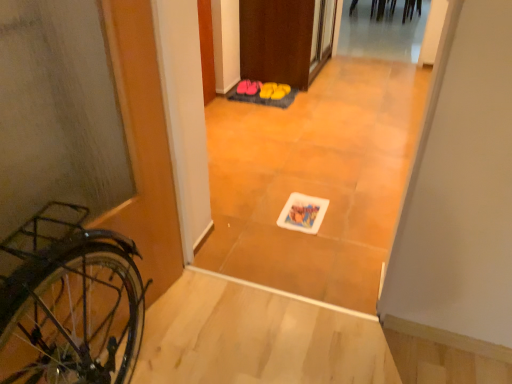
What do you see at coordinates (253, 87) in the screenshot?
I see `pink fabric slippers at center, the second footwear from the left` at bounding box center [253, 87].

The width and height of the screenshot is (512, 384). What do you see at coordinates (131, 144) in the screenshot?
I see `matte black bicycle at left` at bounding box center [131, 144].

You are a GUI agent. You are given a task and a screenshot of the screen. Output one action in this format:
    pyautogui.click(x=<x>, y=<y>)
    Task: Click on the pink fabric slippers at center, arranged as the 3th footwear when viewed from the left
    This screenshot has width=512, height=384.
    Given the screenshot: What is the action you would take?
    pyautogui.click(x=263, y=89)

Is pink fabric slippers at center, which is the 4th footwear in right-to-left order, far from yellow fabric shoe at center, acting as the fourth footwear starting from the left?

pink fabric slippers at center, which is the 4th footwear in right-to-left order, is near yellow fabric shoe at center, acting as the fourth footwear starting from the left, not far away.

Can you confirm if pink fabric slippers at center, the second footwear from the left, is positioned to the left of yellow fabric shoe at center, acting as the fourth footwear starting from the left?

Indeed, pink fabric slippers at center, the second footwear from the left, is positioned on the left side of yellow fabric shoe at center, acting as the fourth footwear starting from the left.

Considering the sizes of objects pink fabric slippers at center, which is the 4th footwear in right-to-left order, and yellow fabric shoe at center, acting as the fourth footwear starting from the left, in the image provided, who is smaller, pink fabric slippers at center, which is the 4th footwear in right-to-left order, or yellow fabric shoe at center, acting as the fourth footwear starting from the left,?

pink fabric slippers at center, which is the 4th footwear in right-to-left order, is smaller.

Considering the relative positions of yellow fabric shoe at center, acting as the fourth footwear starting from the left, and matte black bicycle at left in the image provided, is yellow fabric shoe at center, acting as the fourth footwear starting from the left, behind matte black bicycle at left?

Yes, it is behind matte black bicycle at left.

From a real-world perspective, is yellow fabric shoe at center, marked as the second footwear in a right-to-left arrangement, physically below matte black bicycle at left?

Yes, from a real-world perspective, yellow fabric shoe at center, marked as the second footwear in a right-to-left arrangement, is beneath matte black bicycle at left.

Between yellow fabric shoe at center, acting as the fourth footwear starting from the left, and matte black bicycle at left, which one has larger size?

Bigger between the two is matte black bicycle at left.

Is there a large distance between pink fabric slippers at center, the second footwear from the left, and yellow rubber boots at center, arranged as the 5th footwear when viewed from the left?

No.

Considering the positions of objects pink fabric slippers at center, which is the 4th footwear in right-to-left order, and yellow rubber boots at center, marked as the 1th footwear in a right-to-left arrangement, in the image provided, who is more to the left, pink fabric slippers at center, which is the 4th footwear in right-to-left order, or yellow rubber boots at center, marked as the 1th footwear in a right-to-left arrangement,?

pink fabric slippers at center, which is the 4th footwear in right-to-left order.

How distant is pink fabric slippers at center, which is the 4th footwear in right-to-left order, from yellow rubber boots at center, marked as the 1th footwear in a right-to-left arrangement?

The distance of pink fabric slippers at center, which is the 4th footwear in right-to-left order, from yellow rubber boots at center, marked as the 1th footwear in a right-to-left arrangement, is 7.27 inches.

Which of these two, pink fabric slippers at center, which is the 4th footwear in right-to-left order, or yellow rubber boots at center, marked as the 1th footwear in a right-to-left arrangement, is bigger?

yellow rubber boots at center, marked as the 1th footwear in a right-to-left arrangement.

Does yellow fabric shoe at center, acting as the fourth footwear starting from the left, lie in front of pink fabric slippers at center, arranged as the 3th footwear when viewed from the left?

That is False.

Is yellow fabric shoe at center, acting as the fourth footwear starting from the left, taller or shorter than pink fabric slippers at center, the third footwear viewed from the right?

yellow fabric shoe at center, acting as the fourth footwear starting from the left, is shorter than pink fabric slippers at center, the third footwear viewed from the right.

From the image's perspective, which one is positioned higher, yellow fabric shoe at center, acting as the fourth footwear starting from the left, or pink fabric slippers at center, arranged as the 3th footwear when viewed from the left?

yellow fabric shoe at center, acting as the fourth footwear starting from the left, is shown above in the image.

Does point (274, 91) appear closer or farther from the camera than point (252, 95)?

Point (274, 91) is closer to the camera than point (252, 95).

From a real-world perspective, is pink fabric slippers at center, the third footwear viewed from the right, physically above matte black bicycle at left?

Actually, pink fabric slippers at center, the third footwear viewed from the right, is physically below matte black bicycle at left in the real world.

In the scene shown: Is pink fabric slippers at center, arranged as the 3th footwear when viewed from the left, positioned in front of matte black bicycle at left?

No.

Based on the photo, is pink fabric slippers at center, the third footwear viewed from the right, far away from matte black bicycle at left?

Yes.

Considering the sizes of matte black bicycle at left and pink fabric slippers at center, the third footwear viewed from the right, in the image, is matte black bicycle at left taller or shorter than pink fabric slippers at center, the third footwear viewed from the right,?

In the image, matte black bicycle at left appears to be taller than pink fabric slippers at center, the third footwear viewed from the right.

From the image's perspective, which is above, matte black bicycle at left or pink fabric slippers at center, arranged as the 3th footwear when viewed from the left?

pink fabric slippers at center, arranged as the 3th footwear when viewed from the left, appears higher in the image.

From the picture: Is matte black bicycle at left facing away from pink fabric slippers at center, arranged as the 3th footwear when viewed from the left?

matte black bicycle at left is not turned away from pink fabric slippers at center, arranged as the 3th footwear when viewed from the left.

Where is `door that is on the left side of pink fabric shoe at center, acting as the first footwear starting from the left`? Image resolution: width=512 pixels, height=384 pixels. door that is on the left side of pink fabric shoe at center, acting as the first footwear starting from the left is located at coordinates pyautogui.click(x=131, y=144).

Does matte black bicycle at left touch pink fabric shoe at center, acting as the first footwear starting from the left?

No, matte black bicycle at left is not beside pink fabric shoe at center, acting as the first footwear starting from the left.

What's the angular difference between matte black bicycle at left and pink fabric shoe at center, the fifth footwear in the right-to-left sequence,'s facing directions?

There is a 6.99-degree angle between the facing directions of matte black bicycle at left and pink fabric shoe at center, the fifth footwear in the right-to-left sequence.

From a real-world perspective, is matte black bicycle at left over pink fabric shoe at center, acting as the first footwear starting from the left?

Indeed, from a real-world perspective, matte black bicycle at left stands above pink fabric shoe at center, acting as the first footwear starting from the left.

Identify the location of footwear that is the 3rd one above the yellow fabric shoe at center, acting as the fourth footwear starting from the left (from a real-world perspective). The height and width of the screenshot is (384, 512). (253, 87).

Which footwear is the 4th one when counting from the right side of the matte black bicycle at left? Please provide its 2D coordinates.

[(268, 90)]

Considering their positions, is matte black bicycle at left positioned further to pink fabric slippers at center, the third footwear viewed from the right, than yellow fabric shoe at center, marked as the second footwear in a right-to-left arrangement?

The object further to pink fabric slippers at center, the third footwear viewed from the right, is matte black bicycle at left.

Estimate the real-world distances between objects in this image. Which object is closer to pink fabric slippers at center, arranged as the 3th footwear when viewed from the left, yellow fabric shoe at center, acting as the fourth footwear starting from the left, or pink fabric slippers at center, the second footwear from the left?

yellow fabric shoe at center, acting as the fourth footwear starting from the left.

Estimate the real-world distances between objects in this image. Which object is closer to pink fabric slippers at center, the second footwear from the left, pink fabric shoe at center, the fifth footwear in the right-to-left sequence, or pink fabric slippers at center, the third footwear viewed from the right?

pink fabric shoe at center, the fifth footwear in the right-to-left sequence, is positioned closer to the anchor pink fabric slippers at center, the second footwear from the left.

Estimate the real-world distances between objects in this image. Which object is closer to pink fabric slippers at center, the third footwear viewed from the right, yellow fabric shoe at center, acting as the fourth footwear starting from the left, or matte black bicycle at left?

yellow fabric shoe at center, acting as the fourth footwear starting from the left, is closer to pink fabric slippers at center, the third footwear viewed from the right.

Estimate the real-world distances between objects in this image. Which object is further from matte black bicycle at left, pink fabric slippers at center, arranged as the 3th footwear when viewed from the left, or pink fabric slippers at center, the second footwear from the left?

pink fabric slippers at center, the second footwear from the left, lies further to matte black bicycle at left than the other object.

When comparing their distances from yellow fabric shoe at center, acting as the fourth footwear starting from the left, does pink fabric shoe at center, acting as the first footwear starting from the left, or pink fabric slippers at center, the second footwear from the left, seem further?

pink fabric shoe at center, acting as the first footwear starting from the left, is positioned further to the anchor yellow fabric shoe at center, acting as the fourth footwear starting from the left.

Estimate the real-world distances between objects in this image. Which object is further from pink fabric slippers at center, which is the 4th footwear in right-to-left order, yellow fabric shoe at center, acting as the fourth footwear starting from the left, or matte black bicycle at left?

The object further to pink fabric slippers at center, which is the 4th footwear in right-to-left order, is matte black bicycle at left.

When comparing their distances from pink fabric slippers at center, the third footwear viewed from the right, does matte black bicycle at left or pink fabric shoe at center, the fifth footwear in the right-to-left sequence, seem closer?

pink fabric shoe at center, the fifth footwear in the right-to-left sequence.

This screenshot has width=512, height=384. I want to click on footwear between matte black bicycle at left and yellow rubber boots at center, arranged as the 5th footwear when viewed from the left, from front to back, so click(x=263, y=89).

This screenshot has height=384, width=512. I want to click on footwear between pink fabric shoe at center, acting as the first footwear starting from the left, and pink fabric slippers at center, arranged as the 3th footwear when viewed from the left, in the horizontal direction, so click(x=253, y=87).

The width and height of the screenshot is (512, 384). Identify the location of footwear between pink fabric slippers at center, arranged as the 3th footwear when viewed from the left, and yellow rubber boots at center, arranged as the 5th footwear when viewed from the left. (268, 90).